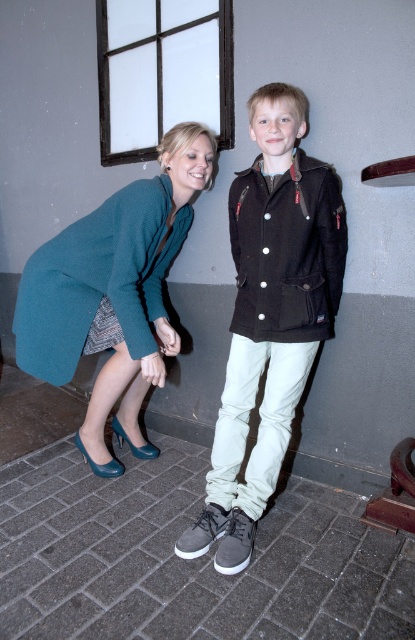
Does dark brown leather jacket at center have a greater width compared to teal fabric coat at lower left?

No.

Between dark brown leather jacket at center and teal fabric coat at lower left, which one is positioned lower?

dark brown leather jacket at center

Which is behind, point (219, 525) or point (166, 244)?

The point (166, 244) is behind.

Locate an element on the screen. dark brown leather jacket at center is located at coordinates (270, 316).